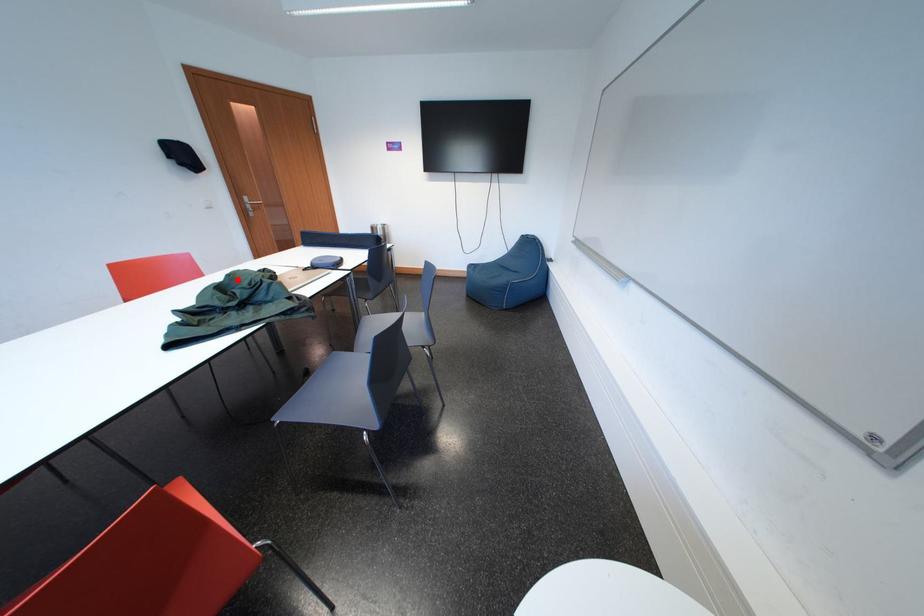
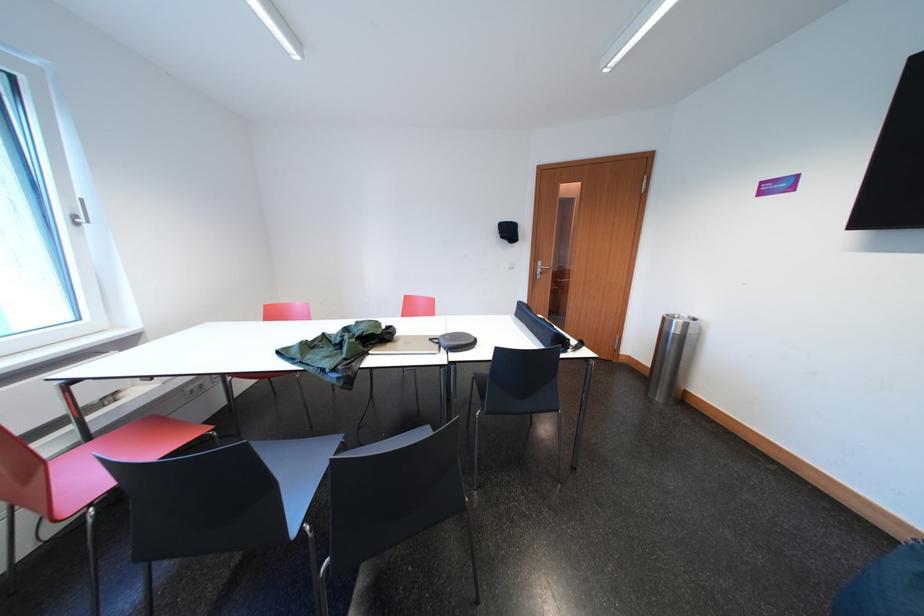
In the second image, find the point that corresponds to the highlighted location in the first image.

(367, 326)